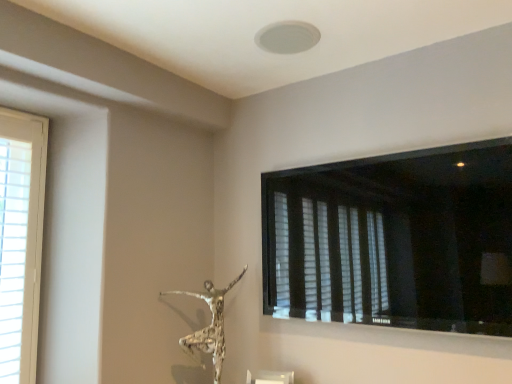
Question: Is silver textured sculpture at center outside white wood window at left, which is counted as the 1th window, starting from the left?

Choices:
 (A) yes
 (B) no

Answer: (A)

Question: Considering the relative positions of silver textured sculpture at center and white wood window at left, which is counted as the 1th window, starting from the left, in the image provided, is silver textured sculpture at center to the right of white wood window at left, which is counted as the 1th window, starting from the left, from the viewer's perspective?

Choices:
 (A) no
 (B) yes

Answer: (B)

Question: Is the surface of silver textured sculpture at center in direct contact with white wood window at left, acting as the 2th window starting from the right?

Choices:
 (A) yes
 (B) no

Answer: (B)

Question: Can you confirm if silver textured sculpture at center is thinner than white wood window at left, acting as the 2th window starting from the right?

Choices:
 (A) yes
 (B) no

Answer: (B)

Question: Considering the relative sizes of silver textured sculpture at center and white wood window at left, which is counted as the 1th window, starting from the left, in the image provided, is silver textured sculpture at center smaller than white wood window at left, which is counted as the 1th window, starting from the left,?

Choices:
 (A) no
 (B) yes

Answer: (A)

Question: Is silver textured sculpture at center far from white wood window at left, which is counted as the 1th window, starting from the left?

Choices:
 (A) yes
 (B) no

Answer: (B)

Question: Does white wood window at left, which is counted as the 1th window, starting from the left, have a greater height compared to black matte window at upper right, which is counted as the 1th window, starting from the right?

Choices:
 (A) yes
 (B) no

Answer: (A)

Question: Is white wood window at left, which is counted as the 1th window, starting from the left, aimed at black matte window at upper right, which is counted as the 1th window, starting from the right?

Choices:
 (A) yes
 (B) no

Answer: (B)

Question: Can you confirm if white wood window at left, which is counted as the 1th window, starting from the left, is shorter than black matte window at upper right, which is counted as the 1th window, starting from the right?

Choices:
 (A) no
 (B) yes

Answer: (A)

Question: Is white wood window at left, acting as the 2th window starting from the right, positioned with its back to black matte window at upper right, which appears as the 2th window when viewed from the left?

Choices:
 (A) yes
 (B) no

Answer: (B)

Question: From the image's perspective, is white wood window at left, which is counted as the 1th window, starting from the left, over black matte window at upper right, which appears as the 2th window when viewed from the left?

Choices:
 (A) yes
 (B) no

Answer: (B)

Question: Is white wood window at left, acting as the 2th window starting from the right, positioned in front of black matte window at upper right, which is counted as the 1th window, starting from the right?

Choices:
 (A) yes
 (B) no

Answer: (B)

Question: Can silver textured sculpture at center be found inside black matte window at upper right, which appears as the 2th window when viewed from the left?

Choices:
 (A) yes
 (B) no

Answer: (B)